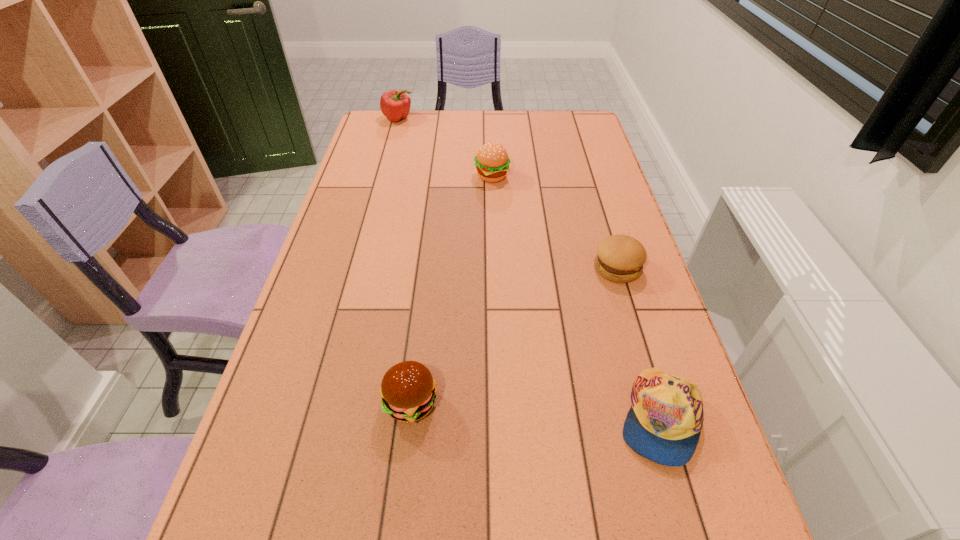
Image resolution: width=960 pixels, height=540 pixels. I want to click on vacant area situated on the right of the fourth nearest object, so click(x=540, y=177).

Where is `free space located on the right of the leftmost hamburger`? The height and width of the screenshot is (540, 960). free space located on the right of the leftmost hamburger is located at coordinates (602, 403).

This screenshot has height=540, width=960. What are the coordinates of `vacant space situated on the front of the rightmost hamburger` in the screenshot? It's located at (662, 414).

Find the location of a particular element. object that is at the far edge is located at coordinates (395, 105).

The width and height of the screenshot is (960, 540). I want to click on object present at the left edge, so click(395, 105).

You are a GUI agent. You are given a task and a screenshot of the screen. Output one action in this format:
    pyautogui.click(x=<x>, y=<y>)
    Task: Click on the cap that is at the right edge
    This screenshot has width=960, height=540.
    Given the screenshot: What is the action you would take?
    pyautogui.click(x=664, y=423)

This screenshot has height=540, width=960. I want to click on hamburger present at the right edge, so click(x=620, y=258).

Image resolution: width=960 pixels, height=540 pixels. I want to click on object that is at the far left corner, so click(395, 105).

Where is `blank space at the far edge`? blank space at the far edge is located at coordinates (480, 137).

Find the location of a particular element. The image size is (960, 540). vacant space at the left edge of the desktop is located at coordinates (356, 207).